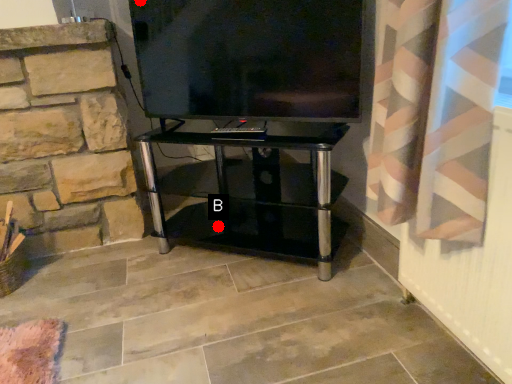
Question: Two points are circled on the image, labeled by A and B beside each circle. Which point is farther to the camera?

Choices:
 (A) A is further
 (B) B is further

Answer: (B)